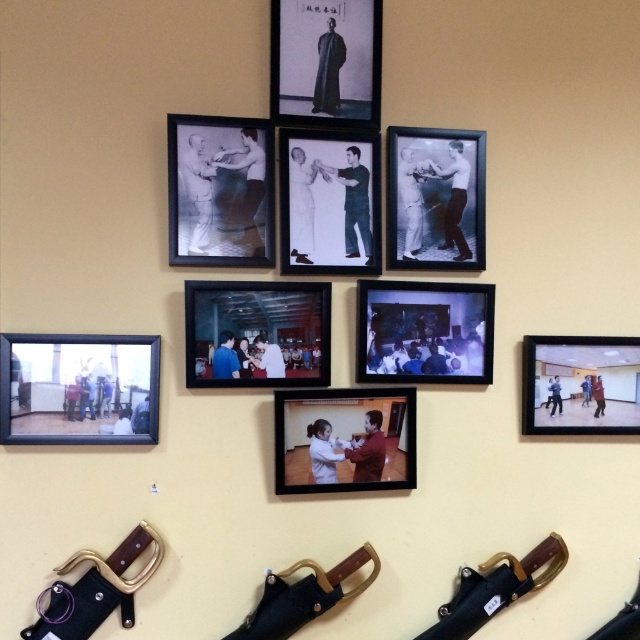
Measure the distance from black paper at center to matte black frame at upper right.

black paper at center and matte black frame at upper right are 65.50 centimeters apart from each other.

What do you see at coordinates (330, 202) in the screenshot? The height and width of the screenshot is (640, 640). I see `black paper at center` at bounding box center [330, 202].

You are a GUI agent. You are given a task and a screenshot of the screen. Output one action in this format:
    pyautogui.click(x=<x>, y=<y>)
    Task: Click on the black paper at center
    The image size is (640, 640).
    Given the screenshot: What is the action you would take?
    pyautogui.click(x=330, y=202)

Is point (445, 252) closer to viewer compared to point (632, 342)?

That is True.

Does black matte photograph at upper center come behind matte black frame at upper right?

That is False.

Where is `black matte photograph at upper center`? Image resolution: width=640 pixels, height=640 pixels. black matte photograph at upper center is located at coordinates (435, 198).

Find the location of a particular element. The width and height of the screenshot is (640, 640). black matte photograph at upper center is located at coordinates (435, 198).

Can you confirm if black matte picture frame at upper left is bigger than matte black frame at upper right?

Yes.

Which is more to the right, black matte picture frame at upper left or matte black frame at upper right?

matte black frame at upper right is more to the right.

Where is `black matte picture frame at upper left`? Image resolution: width=640 pixels, height=640 pixels. black matte picture frame at upper left is located at coordinates (220, 189).